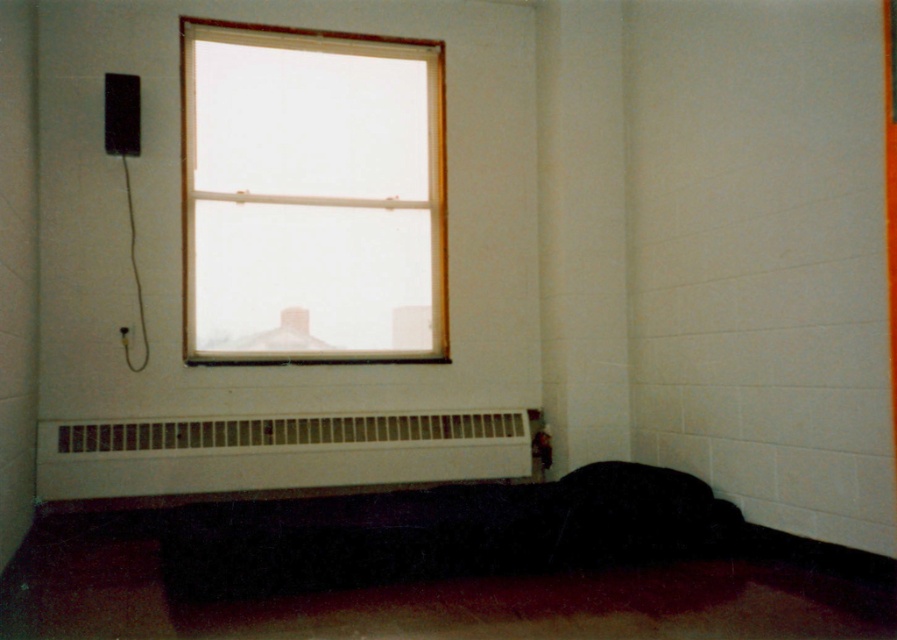
Does clear glass window at upper center have a greater height compared to white matte radiator at lower center?

Yes, clear glass window at upper center is taller than white matte radiator at lower center.

Which is more to the left, clear glass window at upper center or white matte radiator at lower center?

white matte radiator at lower center is more to the left.

Is point (285, 278) behind point (42, 448)?

Yes, it is behind point (42, 448).

At what (x,y) coordinates should I click in order to perform the action: click on clear glass window at upper center. Please return your answer as a coordinate pair (x, y). Looking at the image, I should click on (312, 195).